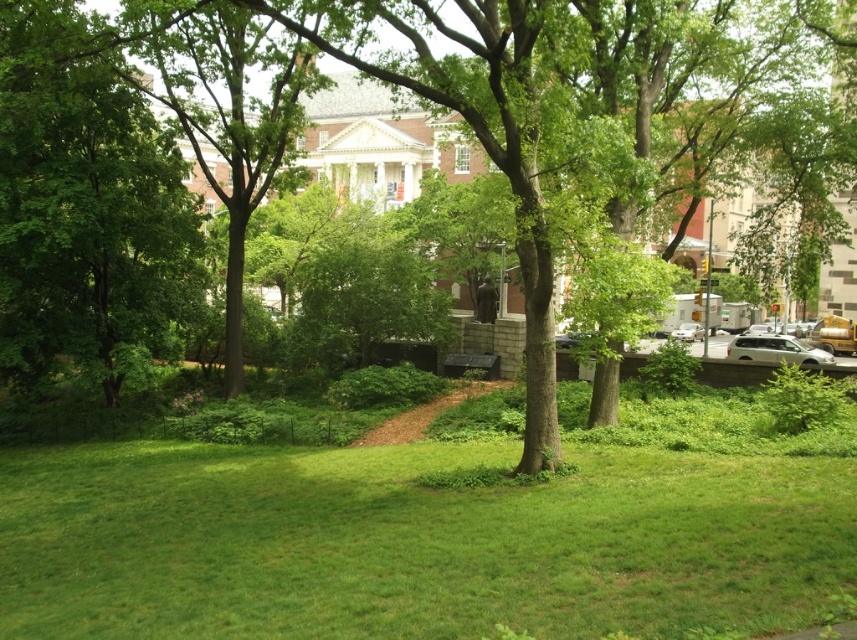
You are standing at the point with coordinates point (792,360) and want to walk towards the point (681,333). Which direction should you face to move towards it?

You should face towards the direction away from the camera since point (681,333) is further from the camera than point (792,360).